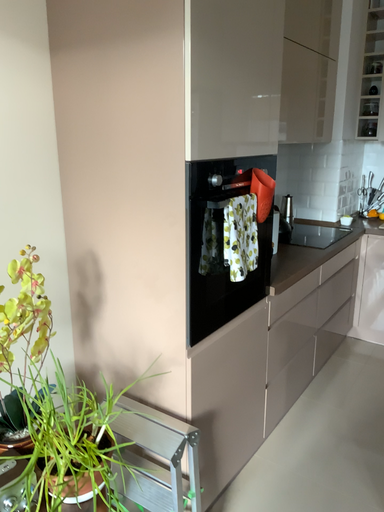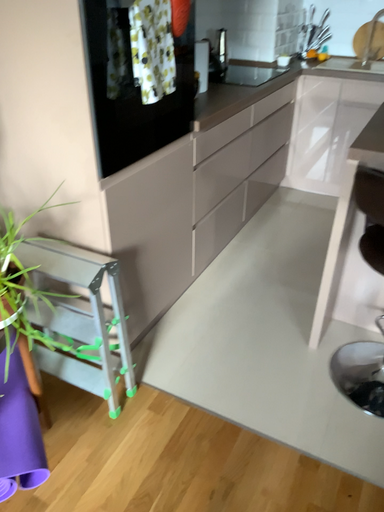
Question: How did the camera likely rotate when shooting the video?

Choices:
 (A) rotated right
 (B) rotated left

Answer: (A)